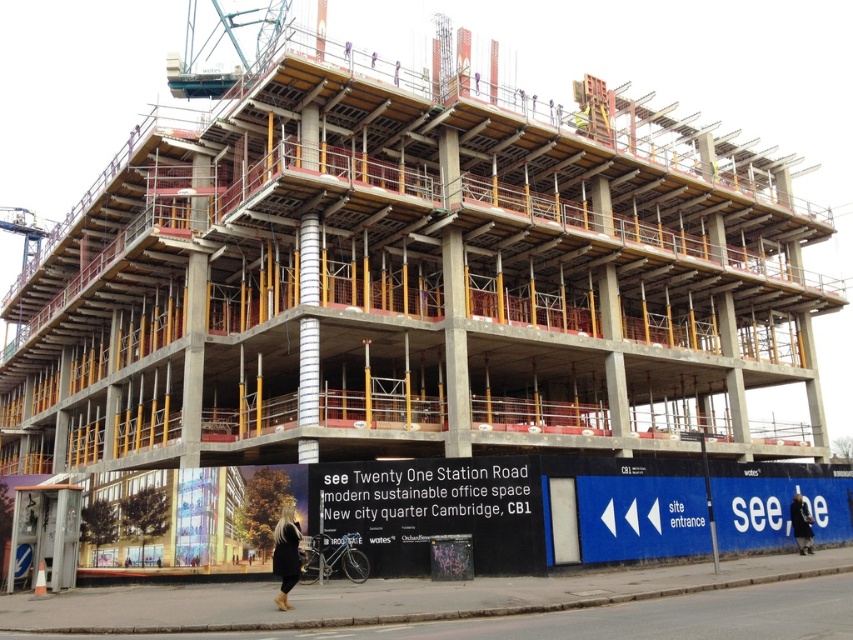
Looking at this image, how much distance is there between black leather jacket at lower center and dark blue jacket at lower center?

black leather jacket at lower center and dark blue jacket at lower center are 38.46 meters apart.

Between black leather jacket at lower center and dark blue jacket at lower center, which one appears on the right side from the viewer's perspective?

Positioned to the right is dark blue jacket at lower center.

Who is more forward, (287, 589) or (799, 540)?

Point (287, 589)

The image size is (853, 640). In order to click on black leather jacket at lower center in this screenshot , I will do `click(286, 554)`.